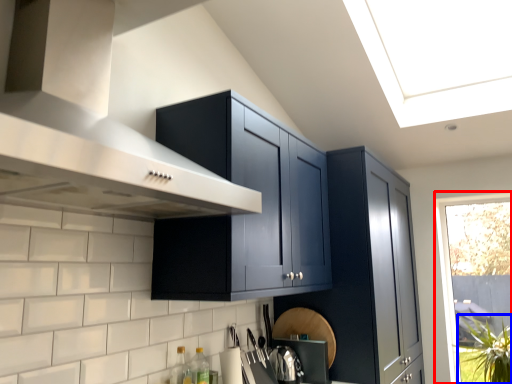
Question: Which point is closer to the camera, window (highlighted by a red box) or plant (highlighted by a blue box)?

Choices:
 (A) window
 (B) plant

Answer: (B)